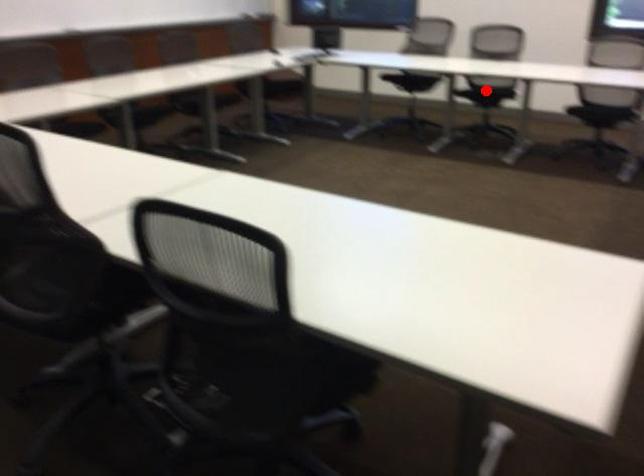
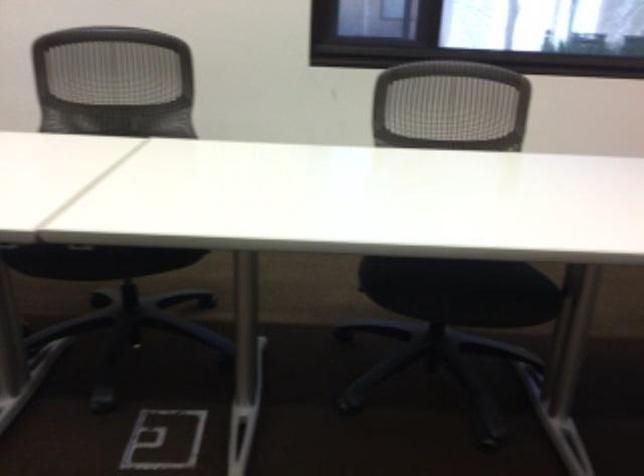
Question: I am providing you with two images of the same scene from different viewpoints. A red point is marked on the first image. Can you still see the location of the red point in image 2?

Choices:
 (A) Yes
 (B) No

Answer: (B)